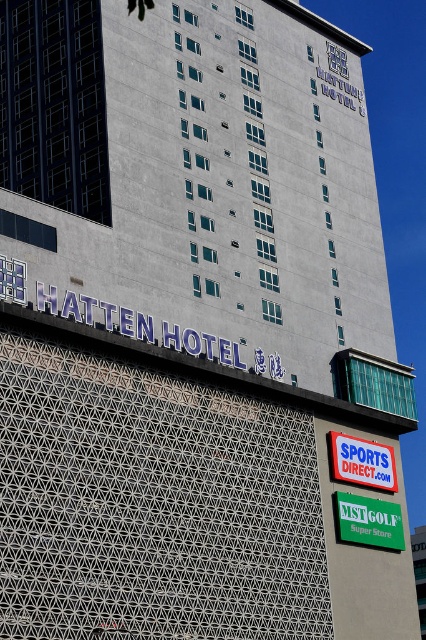
You are standing at the point labeled point (340,522) and want to walk to the HATTEN HOTEL entrance. The distance between your current position and the entrance is 66.91 meters. If you walk at a speed of 1.5 meters per second, how many seconds will it take you to reach the entrance?

The distance between the point labeled point (340,522) and the HATTEN HOTEL entrance is 66.91 meters. At a walking speed of 1.5 meters per second, it will take approximately 44.6 seconds to reach the entrance.

You are standing in front of the HATTEN HOTEL and want to find the green plastic mst golf super store sign at lower right. Based on the coordinates provided, where should you look relative to the hotel building?

The green plastic mst golf super store sign at lower right is located at coordinates point (368, 522), which is on the lower right side of the image relative to the hotel building.